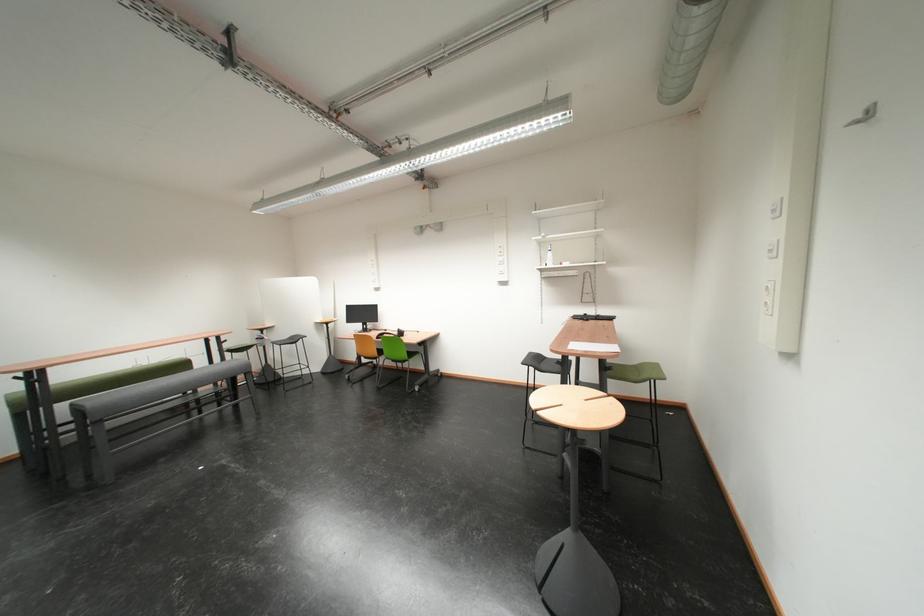
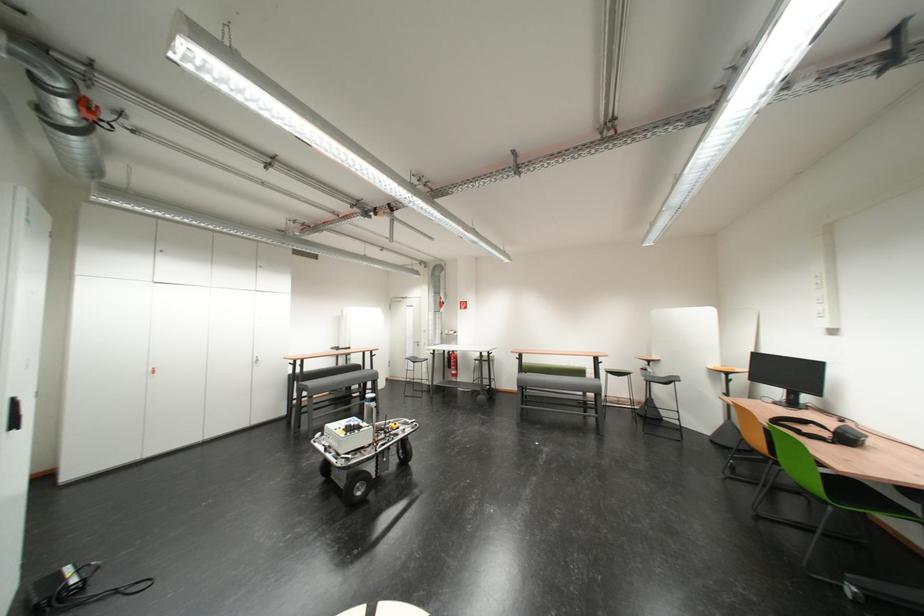
Where in the second image is the point corresponding to (x=411, y=336) from the first image?

(858, 440)